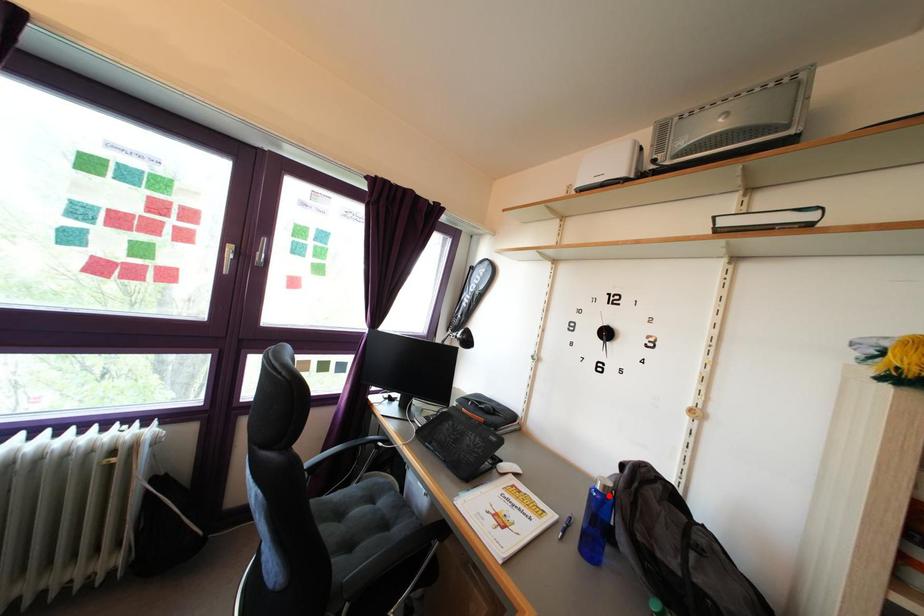
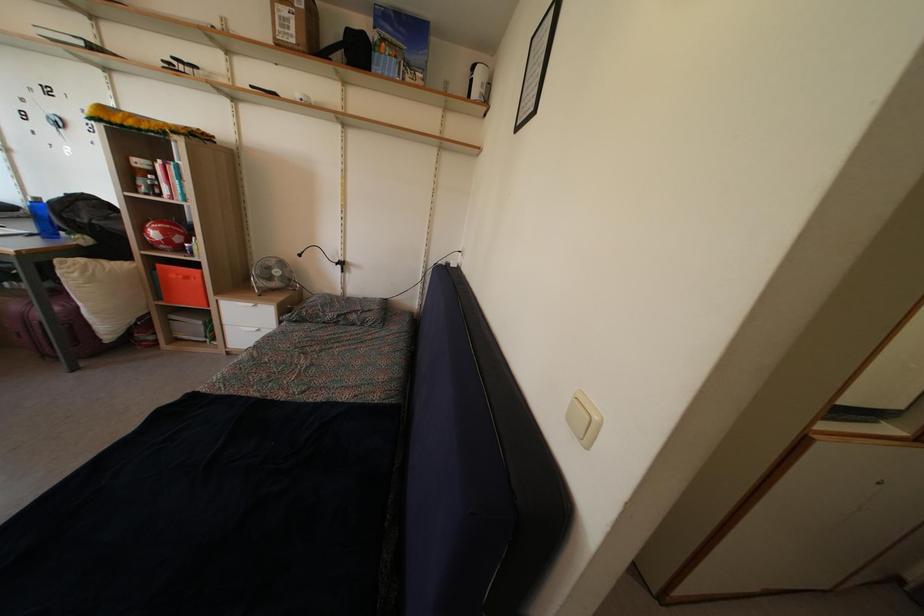
Question: I am providing you with two images of the same scene from different viewpoints. Given a red point in image1, look at the same physical point in image2. Is it:

Choices:
 (A) Closer to the viewpoint
 (B) Farther from the viewpoint

Answer: (B)